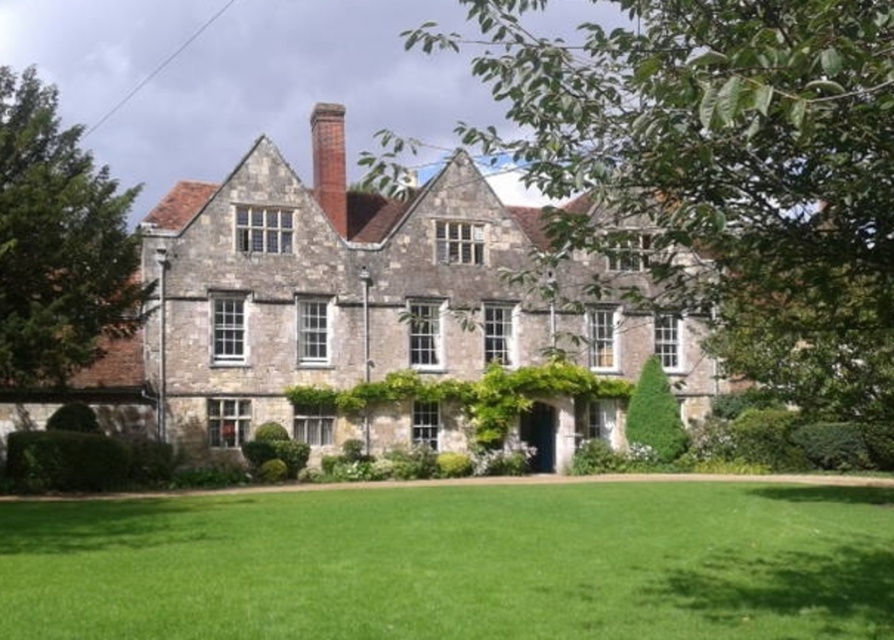
Question: Which is nearer to the green grass at lower center?

Choices:
 (A) green leafy tree at upper left
 (B) green leafy tree at center

Answer: (B)

Question: Does green leafy tree at center appear under green leafy tree at upper left?

Choices:
 (A) no
 (B) yes

Answer: (B)

Question: Which object is closer to the camera taking this photo?

Choices:
 (A) green grass at lower center
 (B) green leafy tree at center
 (C) red brick chimney at center
 (D) green leafy tree at upper left

Answer: (B)

Question: Is green leafy tree at center positioned at the back of green leafy tree at upper left?

Choices:
 (A) yes
 (B) no

Answer: (B)

Question: Which point appears farthest from the camera in this image?

Choices:
 (A) (79, 236)
 (B) (311, 184)
 (C) (314, 588)

Answer: (B)

Question: Is green leafy tree at center further to camera compared to red brick chimney at center?

Choices:
 (A) no
 (B) yes

Answer: (A)